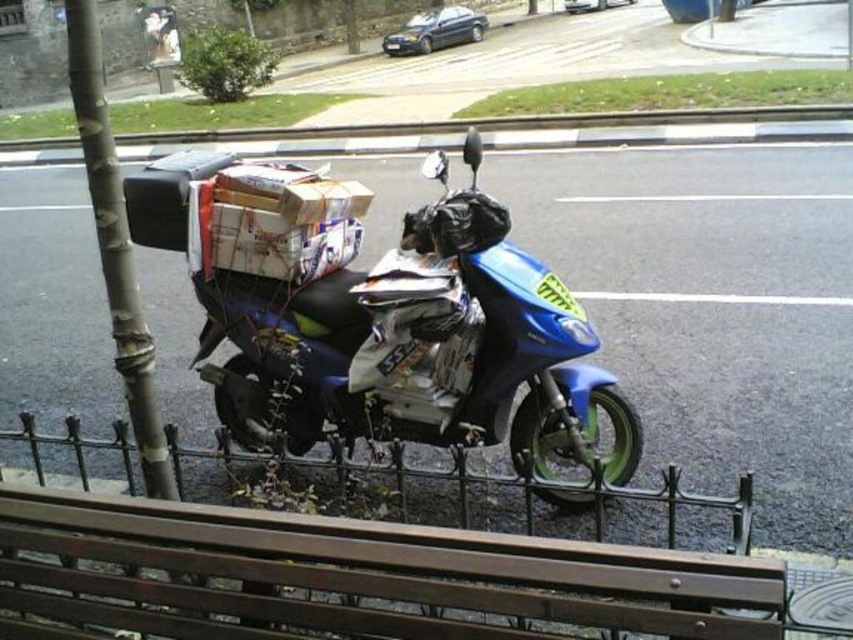
You are a delivery person who needs to park your scooter. You see a brown wooden bench at lower center and a smooth gray pole at left. Which object is closer to the scooter?

The brown wooden bench at lower center is positioned under the smooth gray pole at left, so the bench is closer to the scooter than the pole.

You are a delivery person who needs to park your blue glossy motorcycle at center next to the smooth gray pole at left. Can you fit the motorcycle next to the pole without overlapping?

The blue glossy motorcycle at center is bigger than the smooth gray pole at left, so there should be enough space to park the blue glossy motorcycle at center next to the smooth gray pole at left without overlapping.